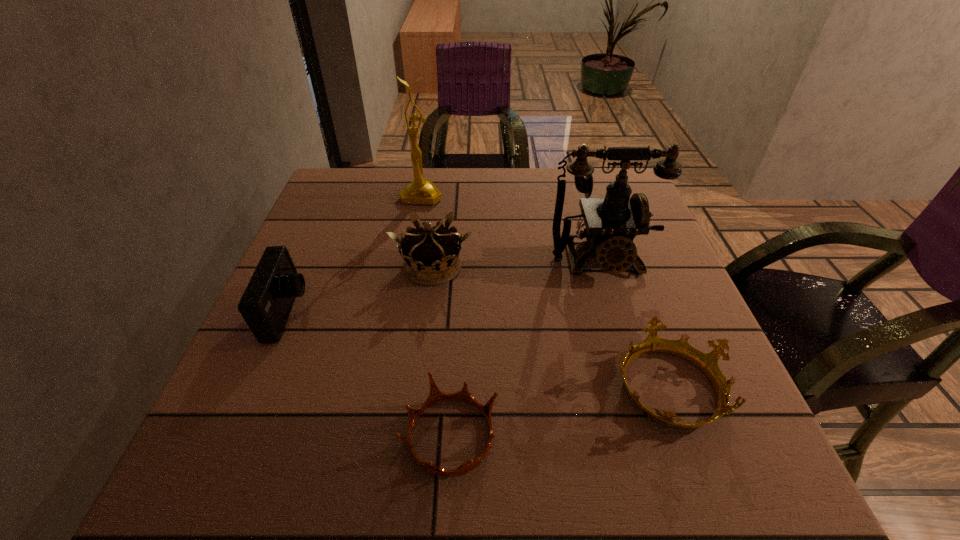
Image resolution: width=960 pixels, height=540 pixels. I want to click on object that is at the far edge, so click(420, 191).

Image resolution: width=960 pixels, height=540 pixels. What are the coordinates of `object that is at the near edge` in the screenshot? It's located at (435, 395).

Image resolution: width=960 pixels, height=540 pixels. In order to click on object present at the left edge in this screenshot , I will do `click(267, 301)`.

This screenshot has height=540, width=960. Identify the location of telephone that is at the right edge. (612, 223).

Identify the location of crown that is at the right edge. This screenshot has width=960, height=540. (707, 362).

What are the coordinates of `free space at the far edge` in the screenshot? It's located at (510, 181).

Locate an element on the screen. This screenshot has width=960, height=540. free space at the near edge of the desktop is located at coordinates (503, 483).

In the image, there is a desktop. Identify the location of vacant area at the left edge. The height and width of the screenshot is (540, 960). (324, 223).

The height and width of the screenshot is (540, 960). In order to click on free region at the right edge of the desktop in this screenshot , I will do `click(748, 429)`.

You are a GUI agent. You are given a task and a screenshot of the screen. Output one action in this format:
    pyautogui.click(x=<x>, y=<y>)
    Task: Click on the blank space at the near left corner of the desktop
    
    Given the screenshot: What is the action you would take?
    pyautogui.click(x=209, y=446)